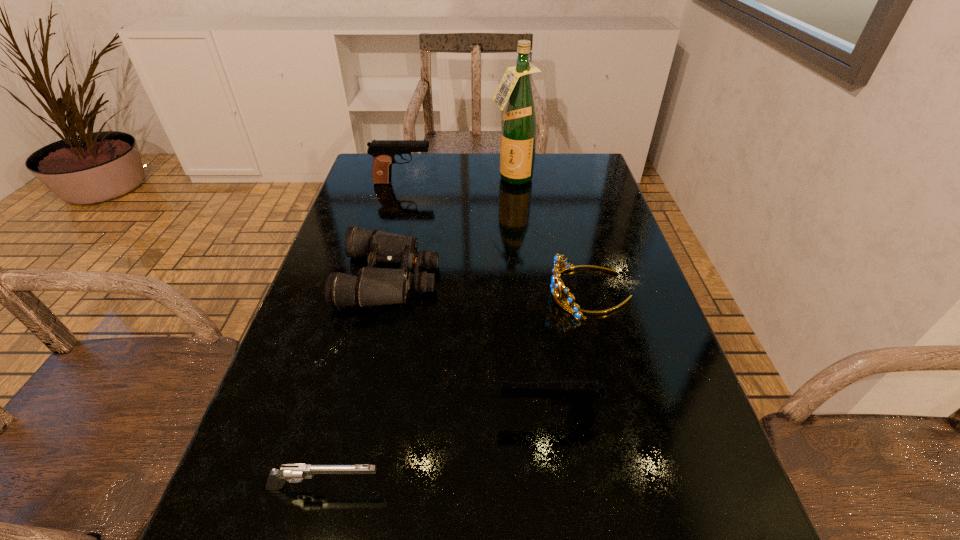
Locate which pistol ranks in proximity to the tallest object. Please provide its 2D coordinates. Your answer should be formatted as a tuple, i.e. [(x, y)], where the tuple contains the x and y coordinates of a point satisfying the conditions above.

[(383, 151)]

You are a GUI agent. You are given a task and a screenshot of the screen. Output one action in this format:
    pyautogui.click(x=<x>, y=<y>)
    Task: Click on the pistol object that ranks as the second closest to the shortest pistol
    The image size is (960, 540).
    Given the screenshot: What is the action you would take?
    pyautogui.click(x=383, y=151)